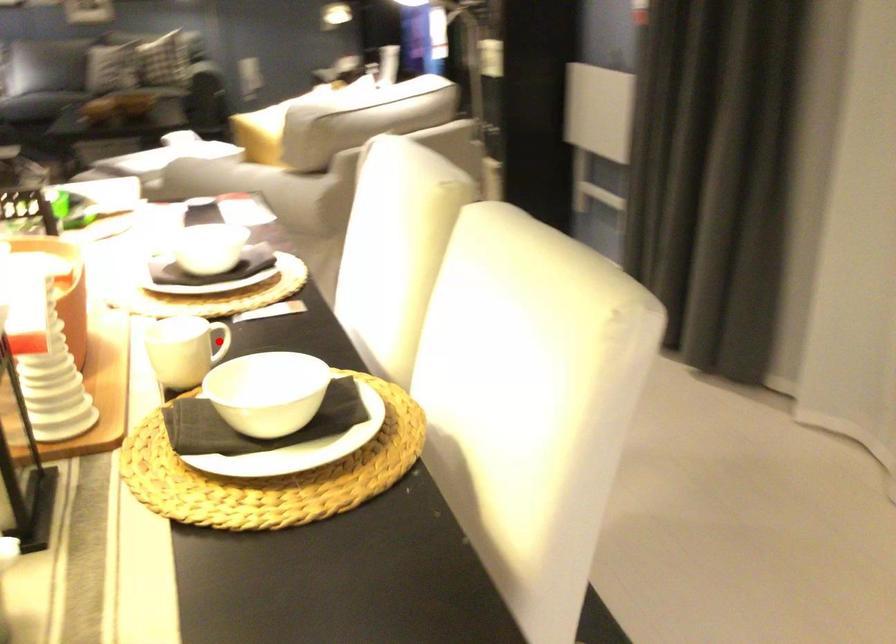
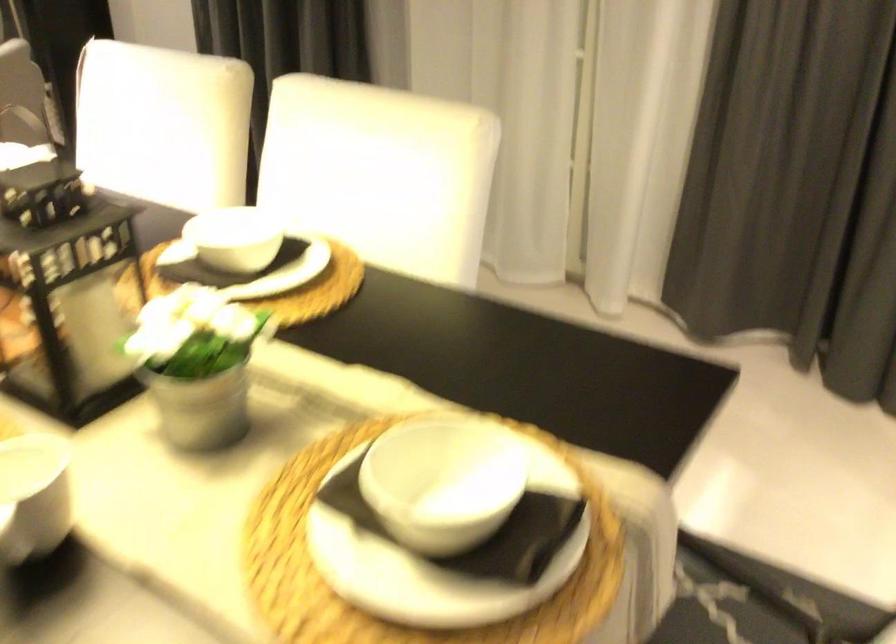
Question: I am providing you with two images of the same scene from different viewpoints. A red point is marked on the first image. Can you still see the location of the red point in image 2?

Choices:
 (A) Yes
 (B) No

Answer: (B)